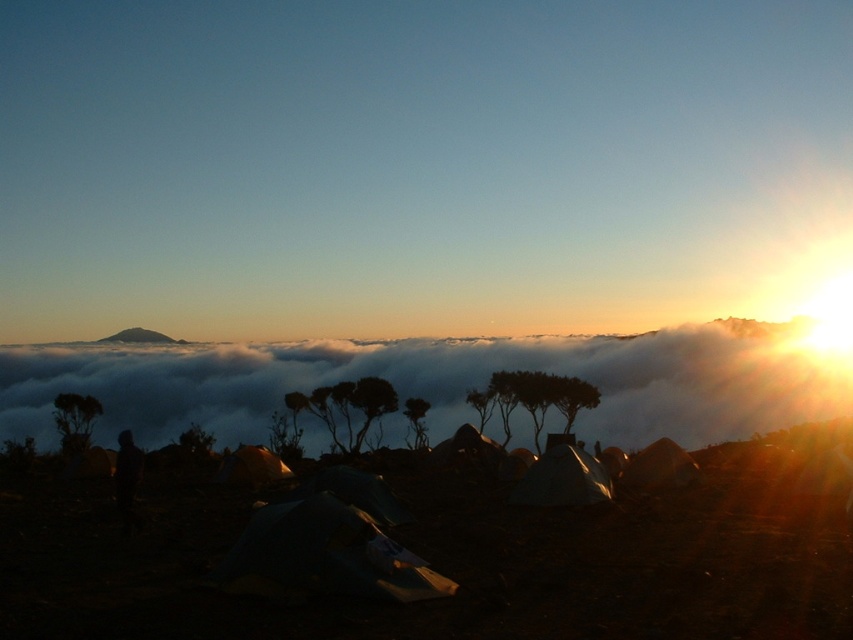
You are planning to set up a new tent at this campsite. You have two tents available, the matte silver tent at lower right and the matte green tent at center. Which tent should you choose if you want a taller one for better visibility of the sunrise?

The matte silver tent at lower right is taller than the matte green tent at center, so you should choose the matte silver tent at lower right for better visibility of the sunrise.

You are planning to set up a new tent at the campsite shown in the image. The existing matte silver tent at lower right is already placed at coordinates point 0.750, 0.660. If you want to place your new tent so that it is directly to the north of the existing one, where should you position it?

To place your new tent directly north of the existing matte silver tent at lower right, you should position it at coordinates point (561, 480) minus the desired distance north. Since the y coordinate decreases as you move north in image coordinates, subtracting from the y value would move it north. For example, moving 0.1 units north would place it at point (477, 480).

You are a hiker who just arrived at the campsite. You see the dark fabric figure at lower center and the smooth gray mountain at upper center. Which object is closer to the ground?

The dark fabric figure at lower center is closer to the ground than the smooth gray mountain at upper center because it is positioned below it.